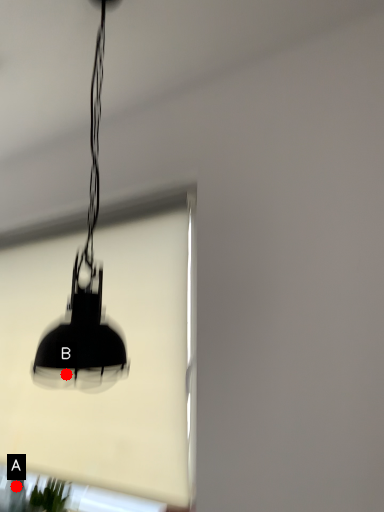
Question: Two points are circled on the image, labeled by A and B beside each circle. Among these points, which one is farthest from the camera?

Choices:
 (A) A is further
 (B) B is further

Answer: (A)